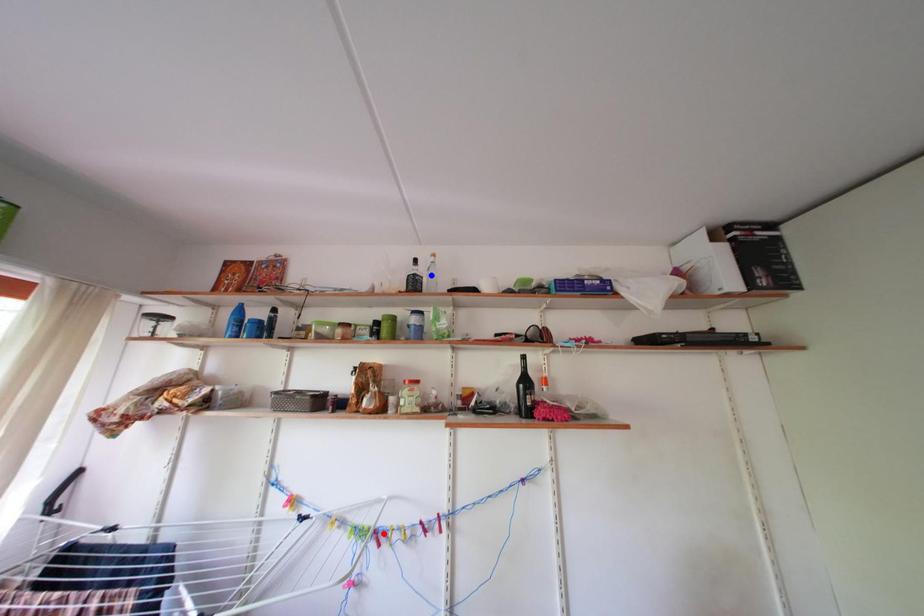
Question: Which of the two points in the image is closer to the camera?

Choices:
 (A) Blue point is closer.
 (B) Red point is closer.

Answer: (B)